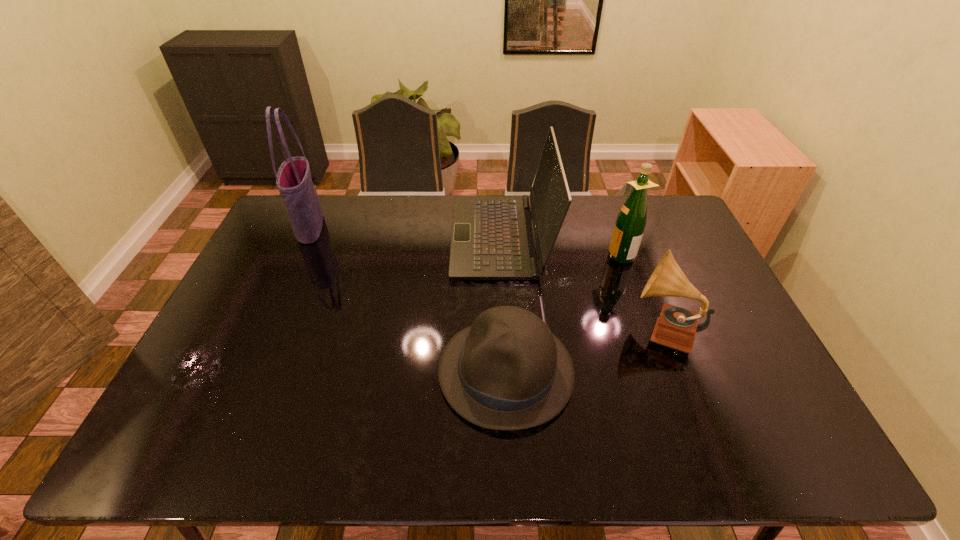
Choose which object is the fourth nearest neighbor to the laptop computer. Please provide its 2D coordinates. Your answer should be formatted as a tuple, i.e. [(x, y)], where the tuple contains the x and y coordinates of a point satisfying the conditions above.

[(293, 179)]

Choose which object is the second nearest neighbor to the laptop computer. Please provide its 2D coordinates. Your answer should be formatted as a tuple, i.e. [(x, y)], where the tuple contains the x and y coordinates of a point satisfying the conditions above.

[(628, 231)]